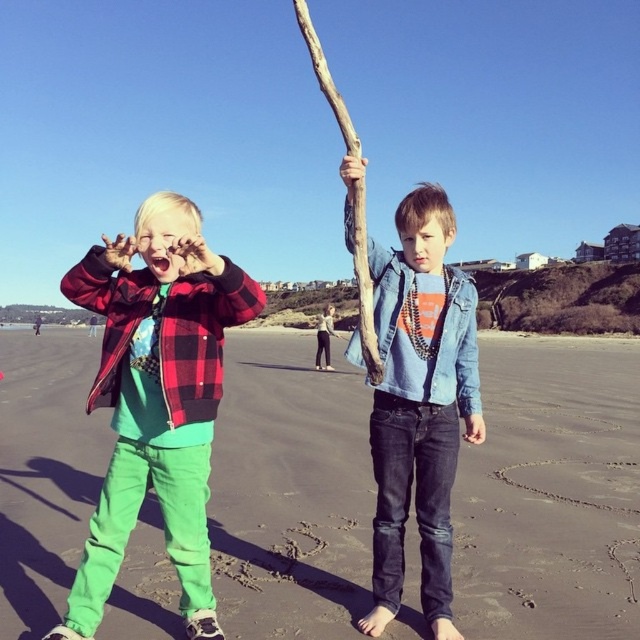
In the scene shown: You are a photographer trying to capture a shot of the brown rough branch at center without the green fabric pants at left blocking the view. From your current position, which direction should you move to ensure the branch is visible and the pants are out of frame?

Move to the right so that the green fabric pants at left is no longer blocking the view of the brown rough branch at center.

You are a photographer trying to capture both the matte plaid jacket at left and the brown rough branch at center in a single frame. Which object should you focus on first to ensure both are in the frame?

The matte plaid jacket at left is shorter than the brown rough branch at center, so you should focus on the brown rough branch at center first to ensure both are in the frame.

You are a photographer trying to capture both the matte plaid jacket at left and the brown rough branch at center in a single frame. Given their sizes, which object should you focus on first to ensure both are in the frame?

The matte plaid jacket at left is smaller than the brown rough branch at center. To include both in the frame, focus on positioning the smaller matte plaid jacket at left first, then adjust to include the larger brown rough branch at center.